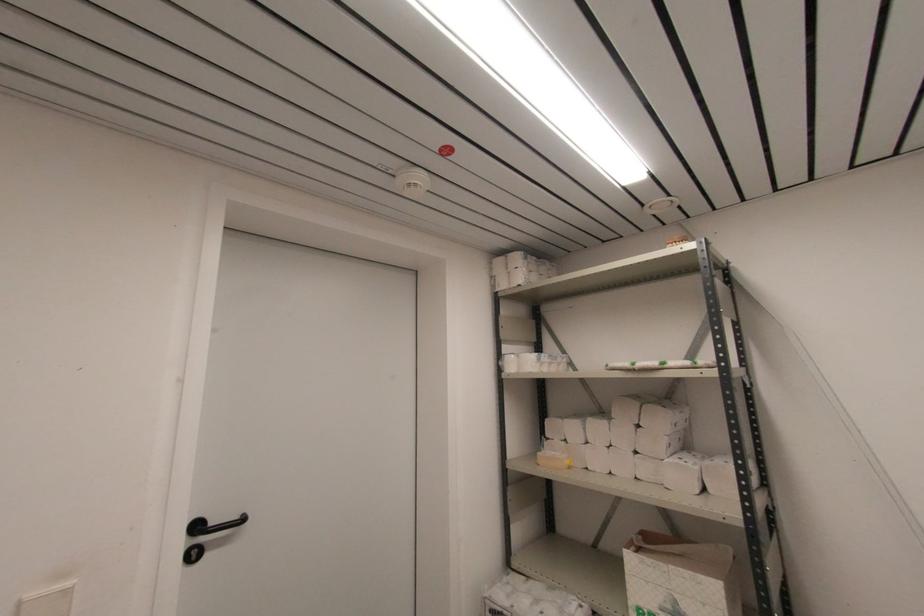
Identify the location of white paper pack. This screenshot has width=924, height=616. click(x=678, y=577).